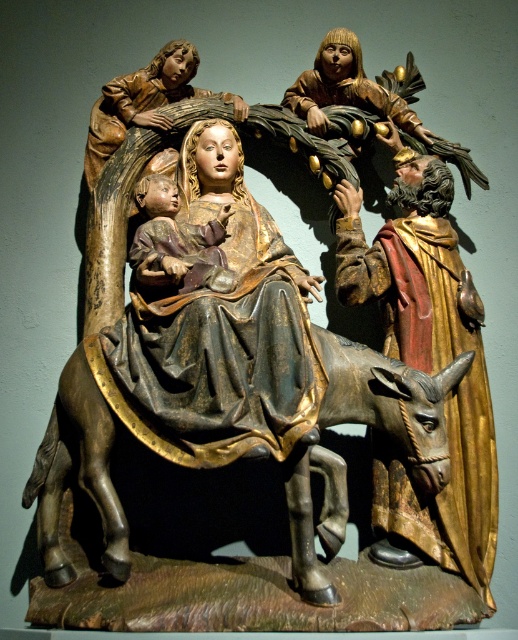
You are an art conservator examining the wooden sculpture. You notice two points of concern marked at coordinates point (452, 308) and point (354, 61). Which point is more accessible for immediate inspection without moving the sculpture?

Point (452, 308) is closer to the camera than point (354, 61), so it is more accessible for immediate inspection without moving the sculpture.

From the picture: You are an art conservator examining the sculpture. You notice two points on the sculpture at coordinates point (151, 118) and point (151, 225). Which point is closer to the front of the sculpture?

Point (151, 225) is closer to the front of the sculpture because it is in front of point (151, 118).